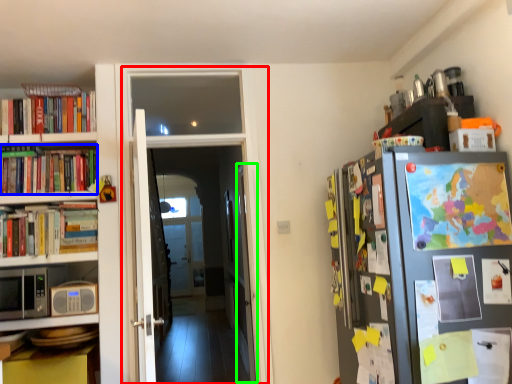
Question: Based on their relative distances, which object is nearer to corridor (highlighted by a red box)? Choose from book (highlighted by a blue box) and door (highlighted by a green box).

Choices:
 (A) book
 (B) door

Answer: (B)